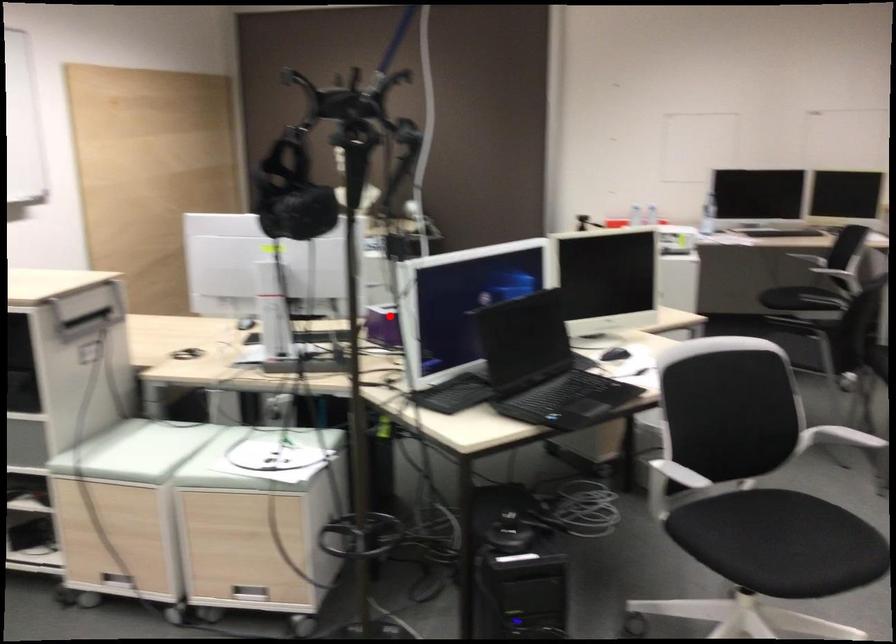
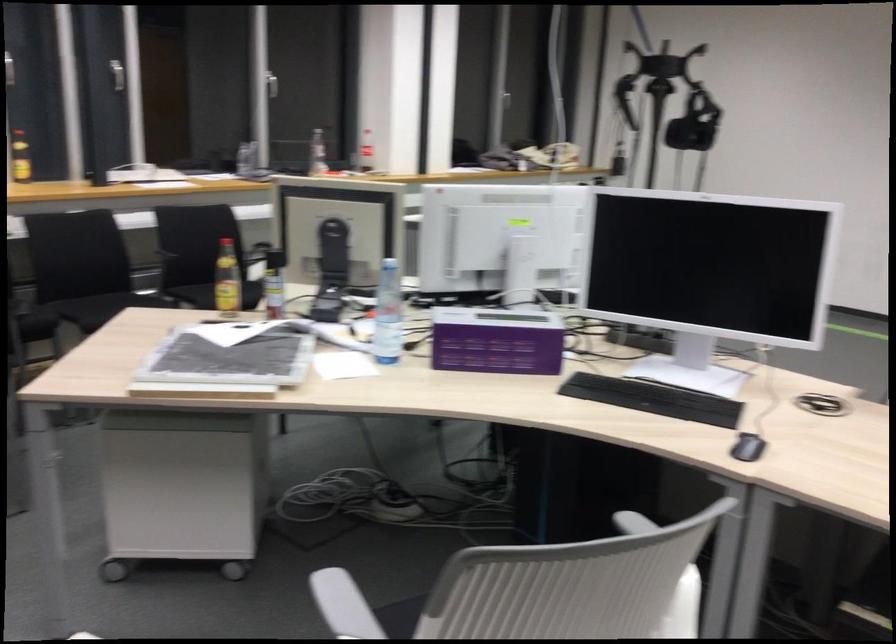
Where in the second image is the point corresponding to the highlighted location from the first image?

(495, 341)